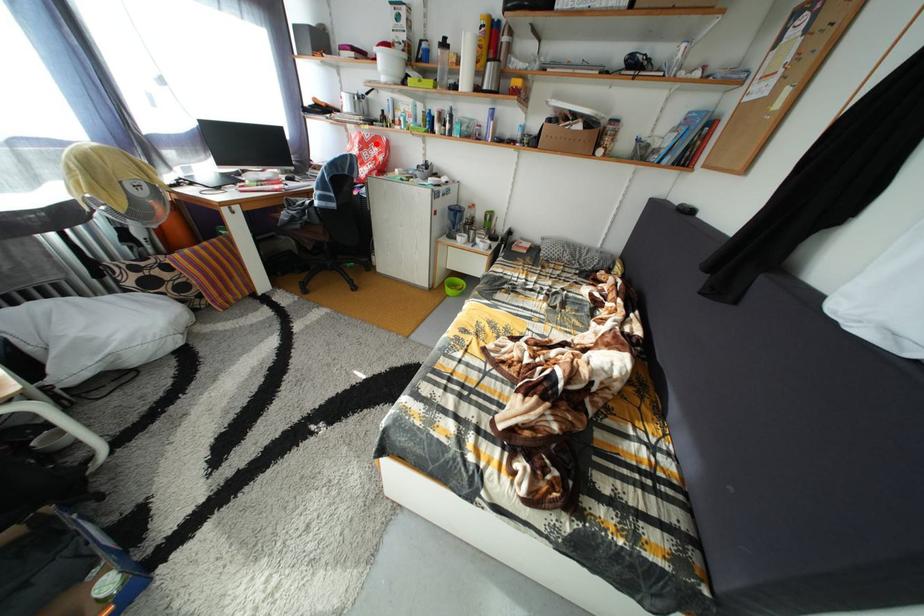
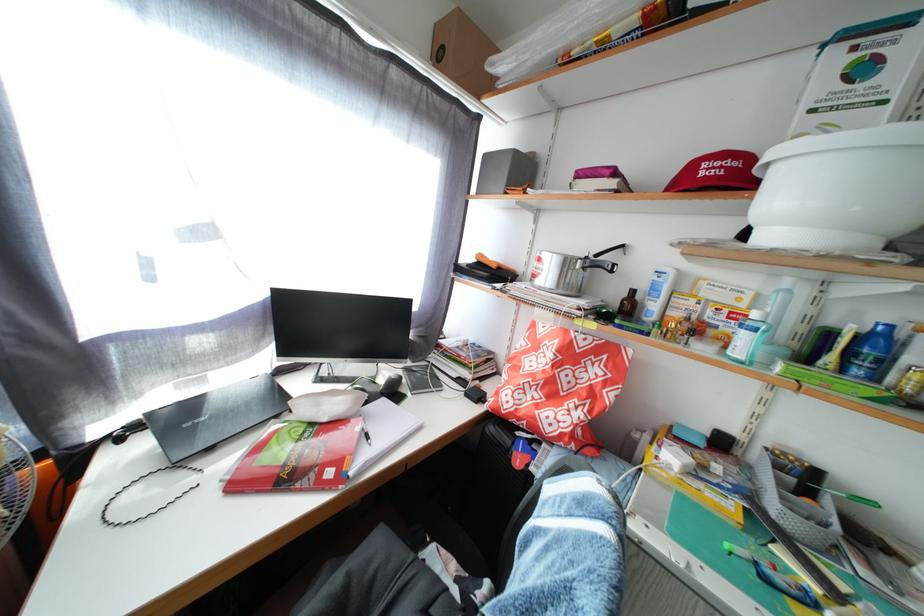
Question: I am providing you with two images of the same scene from different viewpoints. Given a red point in image1, look at the same physical point in image2. Is it:

Choices:
 (A) Closer to the viewpoint
 (B) Farther from the viewpoint

Answer: (B)